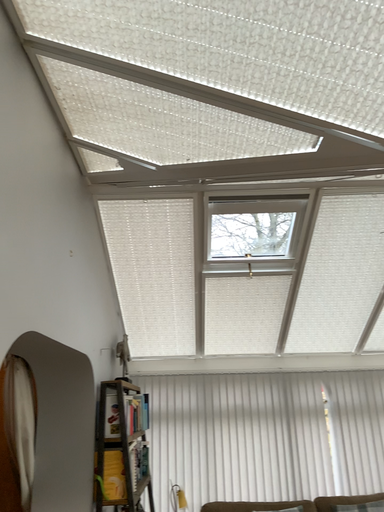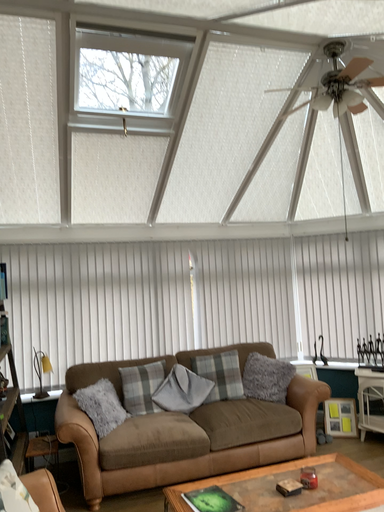
Question: How did the camera likely rotate when shooting the video?

Choices:
 (A) rotated downward
 (B) rotated upward

Answer: (A)